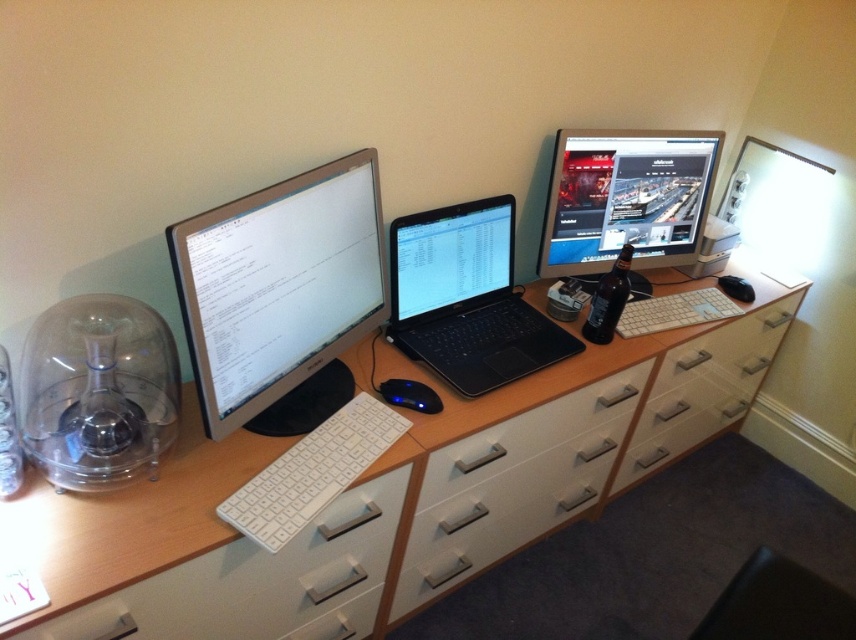
How much distance is there between white plastic drawer at center-right and satin black laptop at center?

white plastic drawer at center-right is 29.03 inches away from satin black laptop at center.

Who is more distant from viewer, (742, 396) or (470, 260)?

Positioned behind is point (742, 396).

The width and height of the screenshot is (856, 640). What do you see at coordinates (703, 387) in the screenshot?
I see `white plastic drawer at center-right` at bounding box center [703, 387].

Where is `white plastic drawer at center-right`? Image resolution: width=856 pixels, height=640 pixels. white plastic drawer at center-right is located at coordinates click(703, 387).

Which is above, white plastic drawer at lower center or black leather chair at lower right?

white plastic drawer at lower center is higher up.

Who is lower down, white plastic drawer at lower center or black leather chair at lower right?

black leather chair at lower right

Who is more forward, (251, 557) or (765, 586)?

Point (251, 557)

Locate an element on the screen. Image resolution: width=856 pixels, height=640 pixels. white plastic drawer at lower center is located at coordinates (259, 582).

Does matte black monitor at upper right come in front of black leather chair at lower right?

No, it is not.

At what (x,y) coordinates should I click in order to perform the action: click on matte black monitor at upper right. Please return your answer as a coordinate pair (x, y). The width and height of the screenshot is (856, 640). Looking at the image, I should click on (626, 200).

Identify the location of matte black monitor at upper right. The width and height of the screenshot is (856, 640). (626, 200).